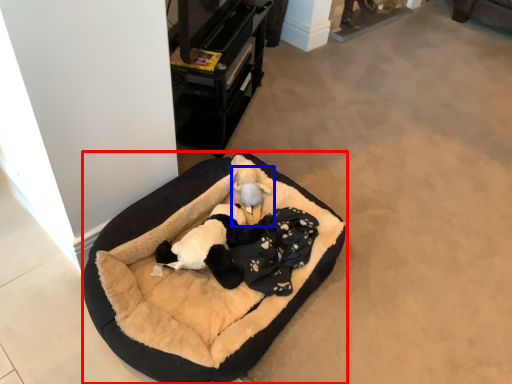
Question: Which object is closer to the camera taking this photo, dog bed (highlighted by a red box) or toy (highlighted by a blue box)?

Choices:
 (A) dog bed
 (B) toy

Answer: (A)